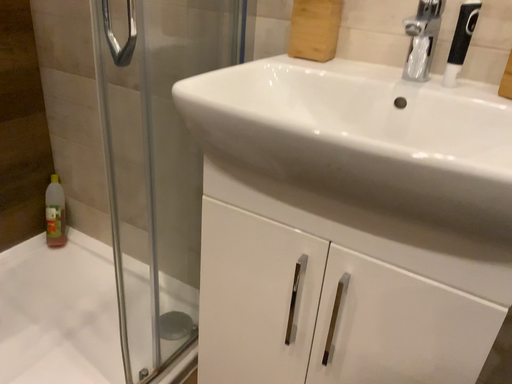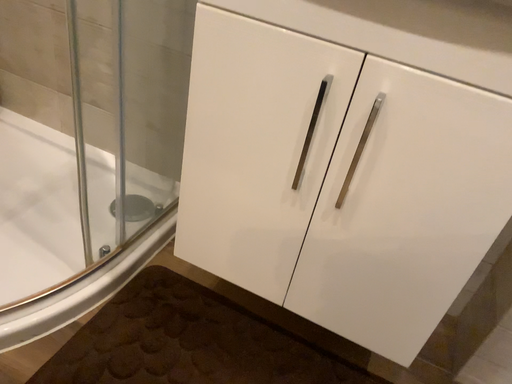
Question: How did the camera likely rotate when shooting the video?

Choices:
 (A) rotated right
 (B) rotated left

Answer: (A)